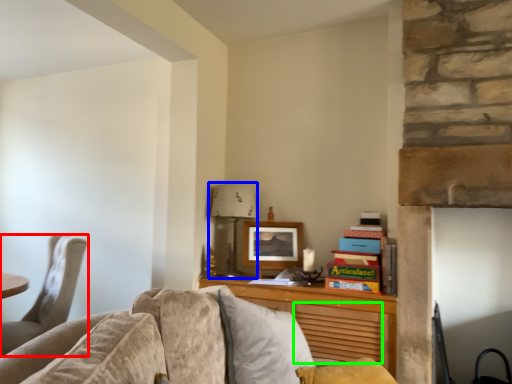
Question: Considering the real-world distances, which object is closest to chair (highlighted by a red box)? lamp (highlighted by a blue box) or drawer (highlighted by a green box).

Choices:
 (A) lamp
 (B) drawer

Answer: (A)